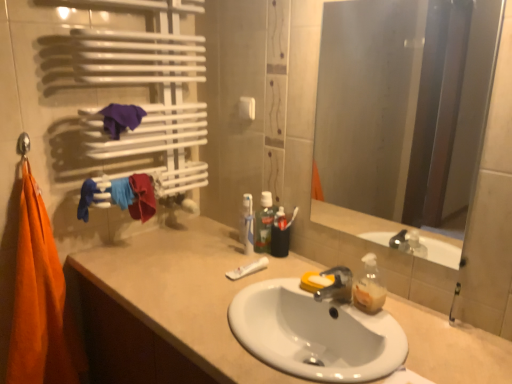
Where is `vacant space to the right of white matte toothpaste at center`? This screenshot has height=384, width=512. vacant space to the right of white matte toothpaste at center is located at coordinates (282, 274).